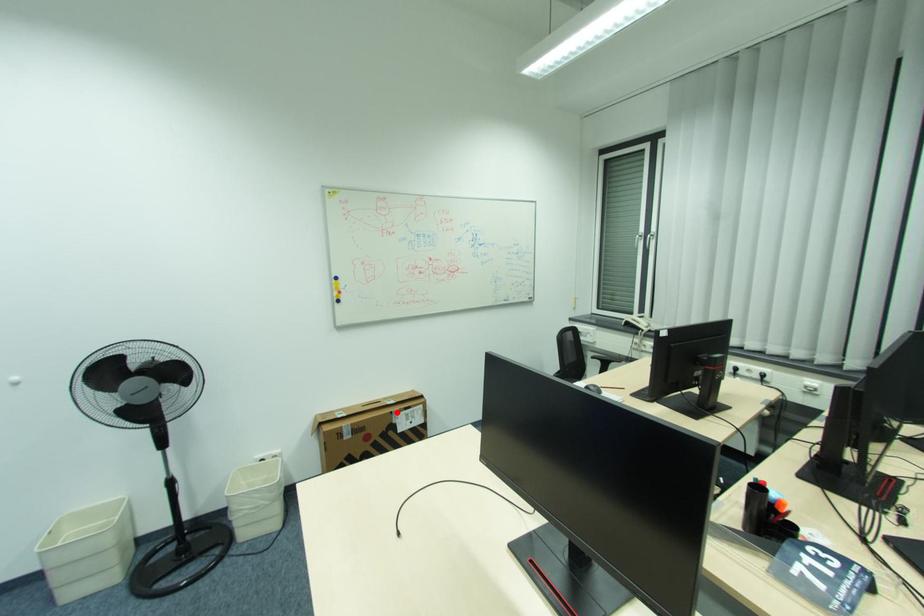
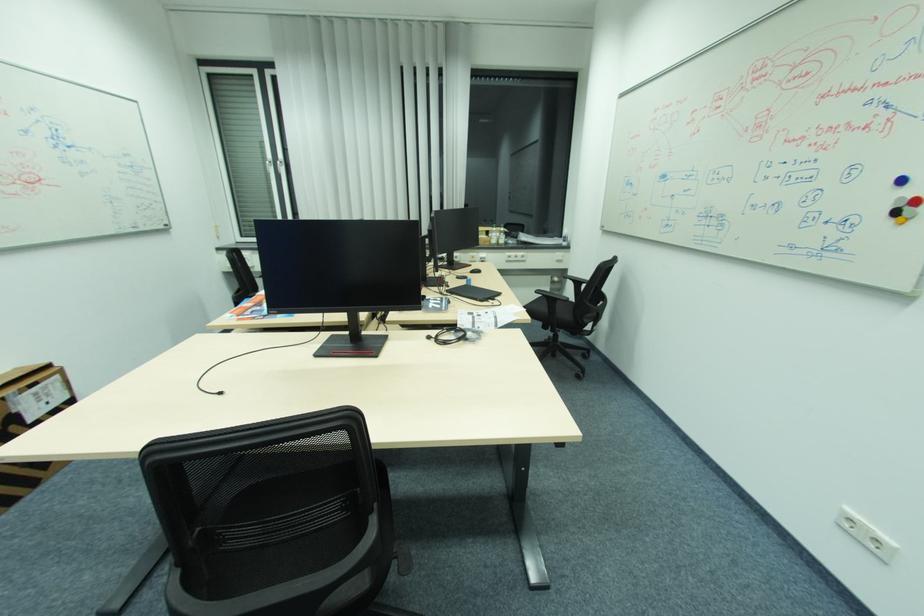
Locate, in the second image, the point that corresponds to the highlighted location in the first image.

(7, 399)